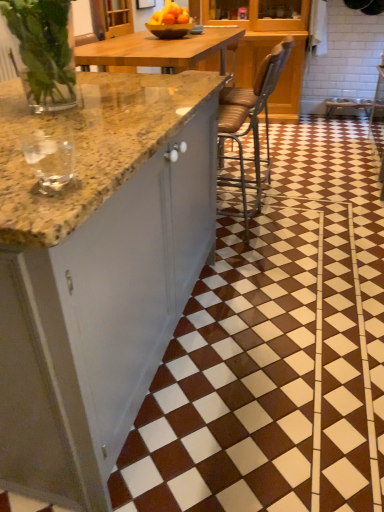
Locate an element on the screen. This screenshot has height=512, width=384. vacant area that is situated to the right of brown leather chair at center is located at coordinates (307, 223).